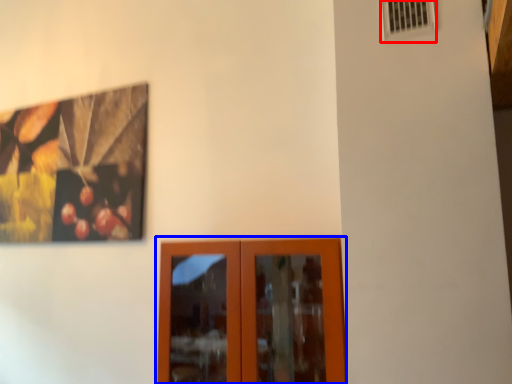
Question: Which object is closer to the camera taking this photo, air conditioning (highlighted by a red box) or door (highlighted by a blue box)?

Choices:
 (A) air conditioning
 (B) door

Answer: (A)